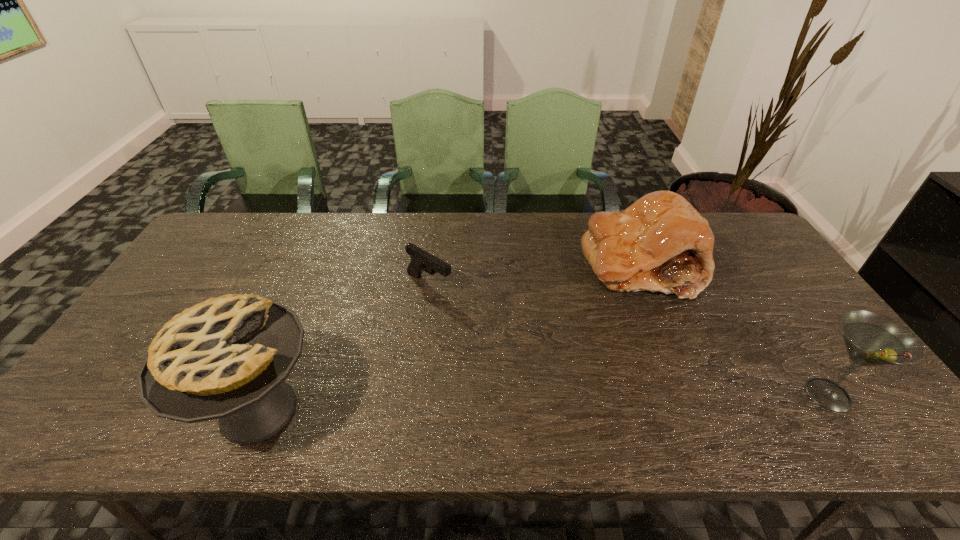
You are a GUI agent. You are given a task and a screenshot of the screen. Output one action in this format:
    pyautogui.click(x=<x>, y=<y>)
    Task: Click on the pie
    The width and height of the screenshot is (960, 540).
    Given the screenshot: What is the action you would take?
    pyautogui.click(x=226, y=358)

In order to click on the rightmost object in this screenshot , I will do `click(871, 339)`.

At what (x,y) coordinates should I click in order to perform the action: click on the third object from right to left. Please return your answer as a coordinate pair (x, y). This screenshot has height=540, width=960. Looking at the image, I should click on (420, 260).

Locate an element on the screen. This screenshot has width=960, height=540. the shortest object is located at coordinates (420, 260).

Where is `the second object from right to left`? This screenshot has width=960, height=540. the second object from right to left is located at coordinates (661, 243).

Find the location of a particular element. Image resolution: width=960 pixels, height=540 pixels. vacant area situated on the back of the martini is located at coordinates (769, 307).

At what (x,y) coordinates should I click in order to perform the action: click on vacant area situated on the front-facing side of the shortest object. Please return your answer as a coordinate pair (x, y). The image size is (960, 540). Looking at the image, I should click on pyautogui.click(x=490, y=319).

Where is `free point located on the front-facing side of the shortest object`? The width and height of the screenshot is (960, 540). free point located on the front-facing side of the shortest object is located at coordinates (543, 353).

The width and height of the screenshot is (960, 540). In order to click on free spot located 0.230m on the front-facing side of the shortest object in this screenshot , I will do `click(510, 332)`.

Locate an element on the screen. The image size is (960, 540). blank space located on the filling side of the second object from right to left is located at coordinates (589, 343).